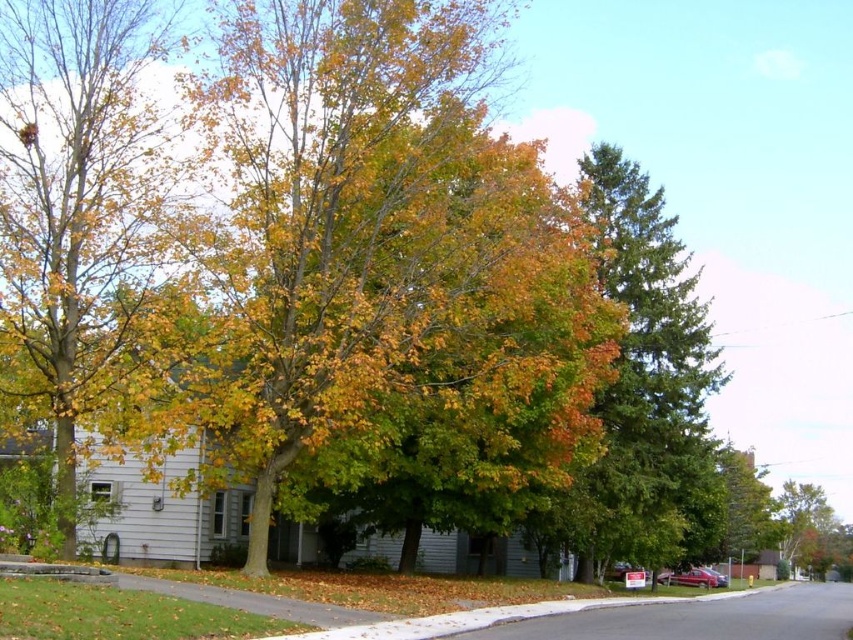
You are standing on the street and want to take a photo of the green textured tree at center. Where should you position yourself to capture the tree in the center of your camera viewfinder?

Position yourself at point [746,508] to capture the green textured tree at center in the center of your camera viewfinder.

You are a gardener planning to plant a new tree in this suburban area. You have two options from the image, the green textured pine tree at center and the green leafy tree at lower right. Considering their widths, which tree would require more horizontal space to accommodate its spread?

The green textured pine tree at center requires more horizontal space because its width surpasses that of the green leafy tree at lower right.